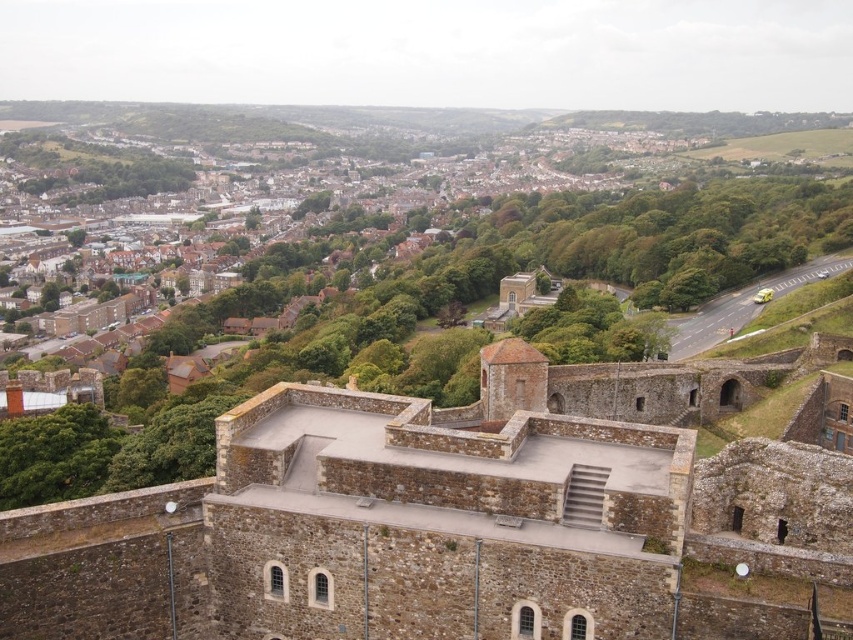
Can you confirm if brown stone castle at center is positioned to the right of brown brick town at upper center?

Indeed, brown stone castle at center is positioned on the right side of brown brick town at upper center.

The image size is (853, 640). What do you see at coordinates (450, 516) in the screenshot?
I see `brown stone castle at center` at bounding box center [450, 516].

Is point (219, 445) positioned before point (373, 196)?

Yes.

This screenshot has height=640, width=853. I want to click on brown stone castle at center, so click(450, 516).